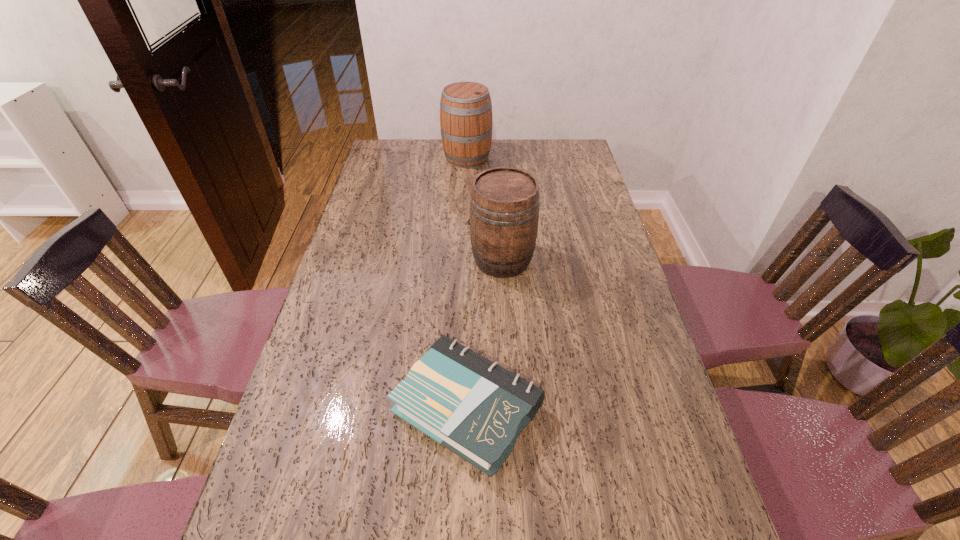
The image size is (960, 540). In order to click on free location that satisfies the following two spatial constraints: 1. on the front side of the farthest object; 2. on the left side of the paperback book in this screenshot , I will do `click(457, 408)`.

Find the location of `vacant point that satisfies the following two spatial constraints: 1. on the side of the nearer cider near the bung hole; 2. on the front side of the shortest object`. vacant point that satisfies the following two spatial constraints: 1. on the side of the nearer cider near the bung hole; 2. on the front side of the shortest object is located at coordinates (510, 408).